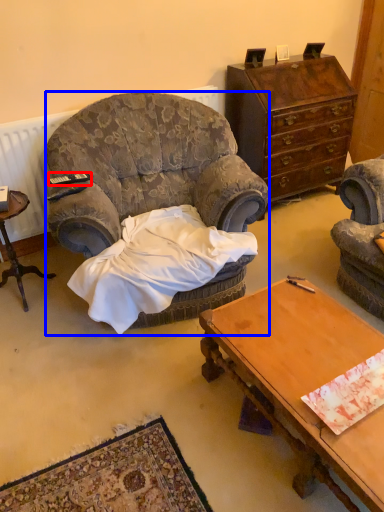
Question: Which of the following is the farthest to the observer, remote control (highlighted by a red box) or chair (highlighted by a blue box)?

Choices:
 (A) remote control
 (B) chair

Answer: (A)